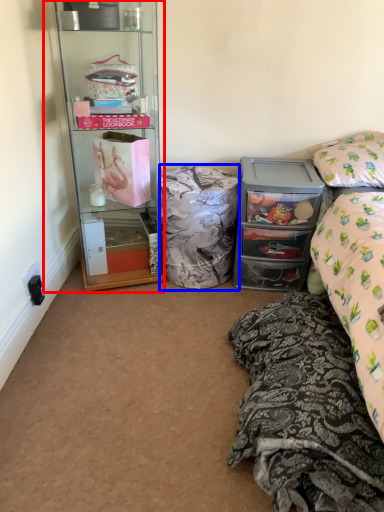
Question: Among these objects, which one is farthest to the camera, desk (highlighted by a red box) or material (highlighted by a blue box)?

Choices:
 (A) desk
 (B) material

Answer: (B)